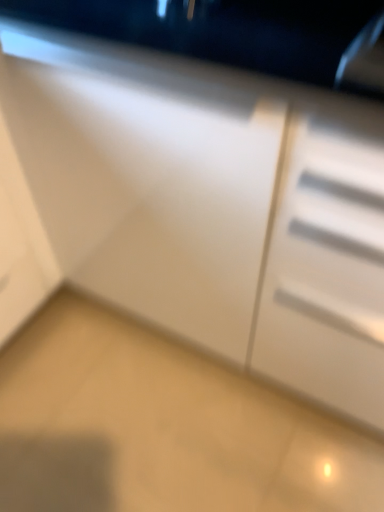
The height and width of the screenshot is (512, 384). Find the location of `white glossy drawer at center`. white glossy drawer at center is located at coordinates (150, 191).

What do you see at coordinates (150, 191) in the screenshot? The image size is (384, 512). I see `white glossy drawer at center` at bounding box center [150, 191].

Find the location of a particular element. This screenshot has width=384, height=512. white glossy drawer at center is located at coordinates (150, 191).